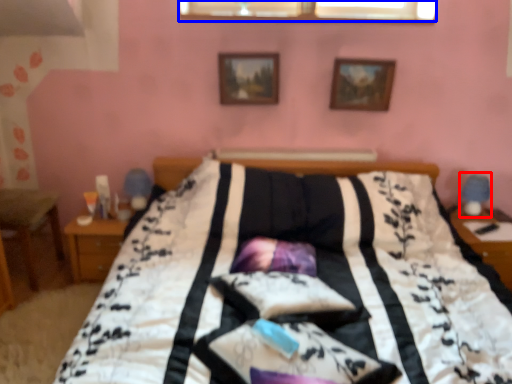
Question: Which object appears farthest to the camera in this image, table lamp (highlighted by a red box) or window (highlighted by a blue box)?

Choices:
 (A) table lamp
 (B) window

Answer: (B)